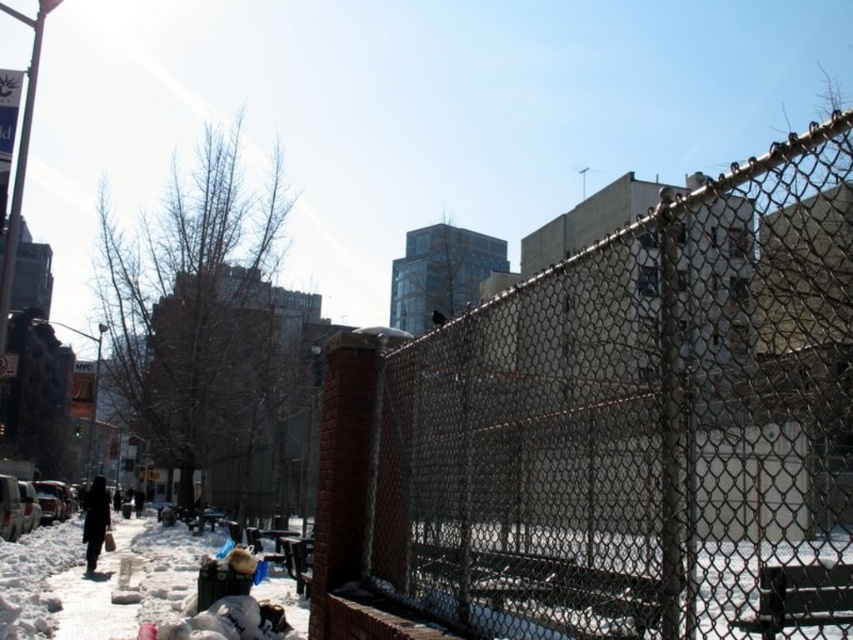
Can you confirm if snowy concrete sidewalk at lower left is positioned to the right of black metal park bench at center?

Incorrect, snowy concrete sidewalk at lower left is not on the right side of black metal park bench at center.

Which is in front, point (13, 564) or point (845, 586)?

Point (845, 586)

Is point (230, 634) positioned after point (775, 634)?

Yes, it is.

Where is `snowy concrete sidewalk at lower left`? This screenshot has width=853, height=640. snowy concrete sidewalk at lower left is located at coordinates (96, 580).

Is metallic chain-link fence at center smaller than black metal park bench at center?

No, metallic chain-link fence at center is not smaller than black metal park bench at center.

Does point (714, 556) lie in front of point (840, 620)?

No, (714, 556) is behind (840, 620).

Who is more forward, [676,476] or [810,596]?

Positioned in front is point [676,476].

Locate an element on the screen. The height and width of the screenshot is (640, 853). metallic chain-link fence at center is located at coordinates (634, 419).

Which is above, black metal park bench at center or dark brown coat at lower left?

black metal park bench at center is above.

Is black metal park bench at center further to camera compared to dark brown coat at lower left?

That is False.

Locate an element on the screen. The height and width of the screenshot is (640, 853). black metal park bench at center is located at coordinates (799, 596).

Where is `black metal park bench at center`? black metal park bench at center is located at coordinates (799, 596).